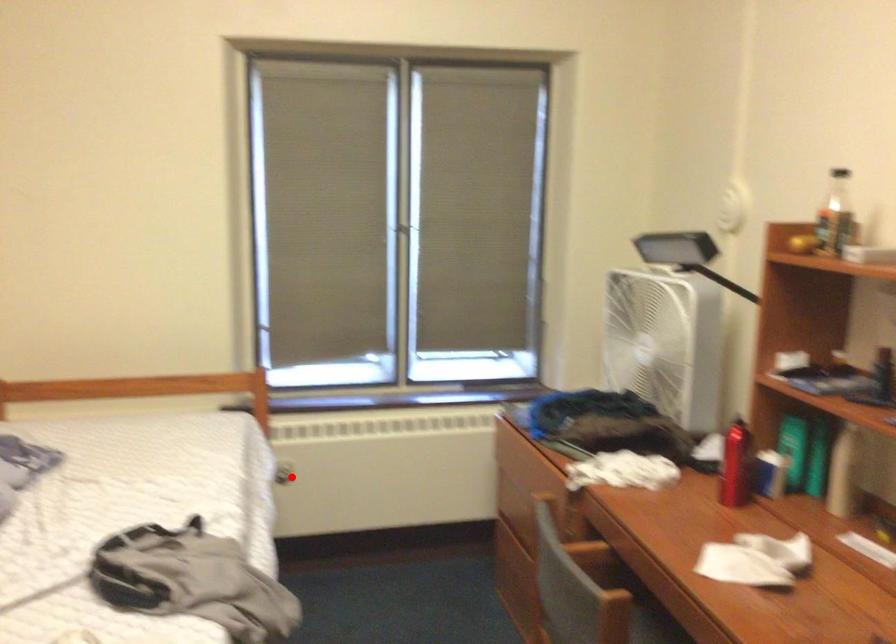
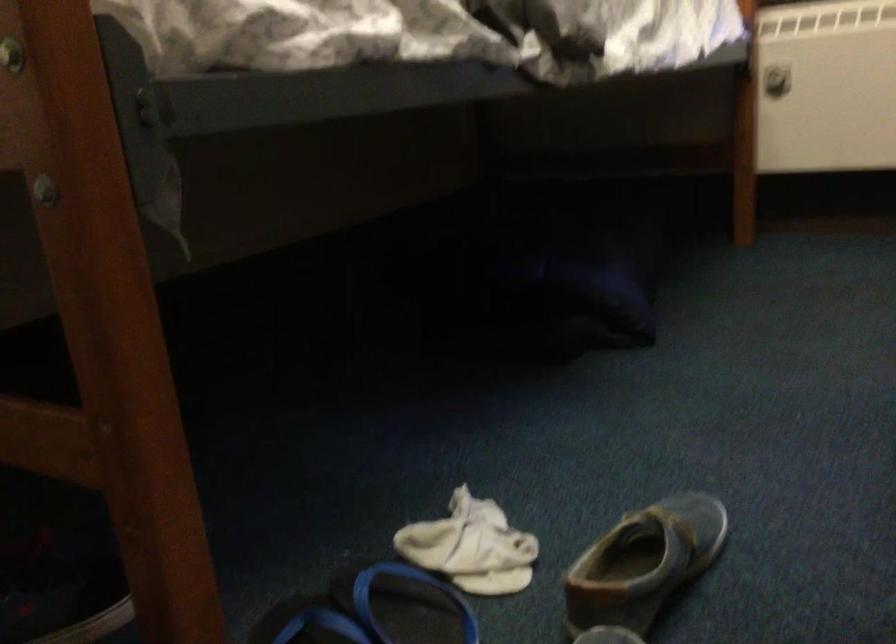
Find the pixel in the second image that matches the highlighted location in the first image.

(776, 80)